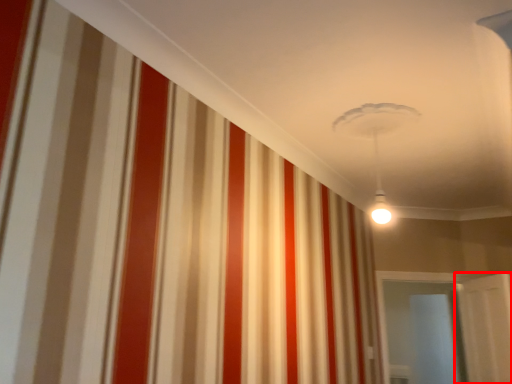
Question: From the image's perspective, what is the correct spatial relationship of door (annotated by the red box) in relation to glass door?

Choices:
 (A) above
 (B) below

Answer: (A)